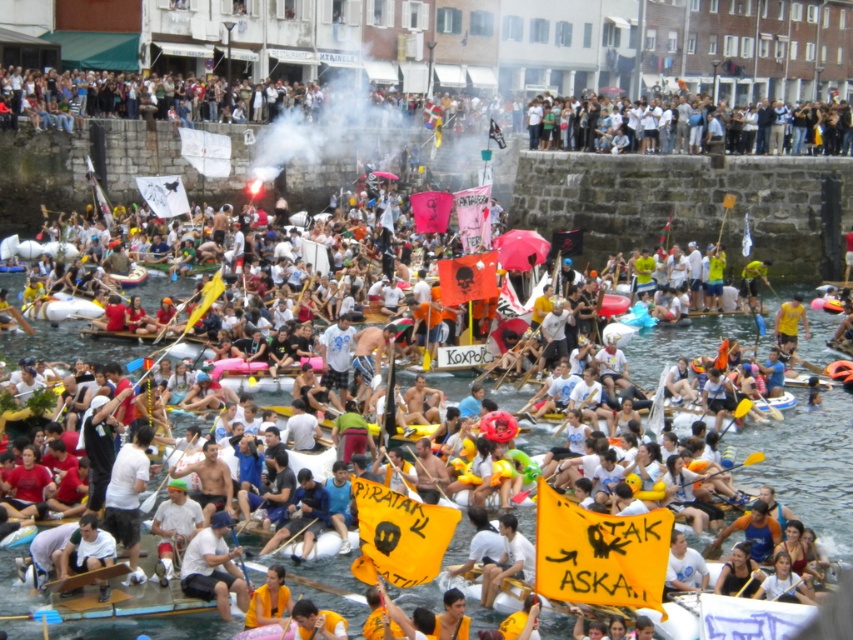
Question: Is white cotton crowd at upper center closer to camera compared to yellow fabric paddle at center?

Choices:
 (A) no
 (B) yes

Answer: (A)

Question: Which object appears closest to the camera in this image?

Choices:
 (A) white cotton crowd at upper center
 (B) white fabric shirt at center

Answer: (B)

Question: Estimate the real-world distances between objects in this image. Which object is farther from the white cotton crowd at upper center?

Choices:
 (A) white fabric shirt at center
 (B) yellow fabric paddle at center

Answer: (A)

Question: Which of the following is the closest to the observer?

Choices:
 (A) (189, 323)
 (B) (210, 552)

Answer: (B)

Question: Can you confirm if white cotton crowd at upper center is wider than white fabric shirt at center?

Choices:
 (A) yes
 (B) no

Answer: (A)

Question: From the image, what is the correct spatial relationship of white cotton crowd at upper center in relation to white fabric shirt at center?

Choices:
 (A) left
 (B) right

Answer: (B)